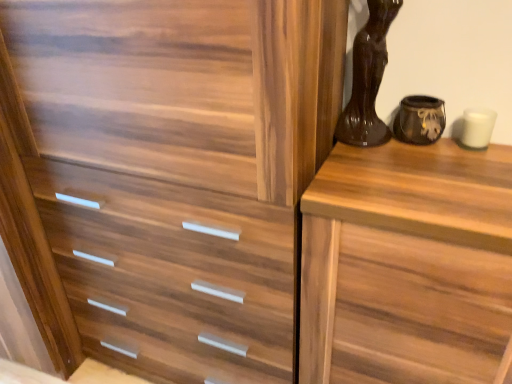
Question: Considering the relative positions of matte black vase at upper right, marked as the 1th vase in a right-to-left arrangement, and wooden chest of drawers at right in the image provided, is matte black vase at upper right, marked as the 1th vase in a right-to-left arrangement, to the left of wooden chest of drawers at right from the viewer's perspective?

Choices:
 (A) no
 (B) yes

Answer: (B)

Question: Is matte black vase at upper right, marked as the 1th vase in a right-to-left arrangement, directly adjacent to wooden chest of drawers at right?

Choices:
 (A) no
 (B) yes

Answer: (A)

Question: Is matte black vase at upper right, marked as the 1th vase in a right-to-left arrangement, not close to wooden chest of drawers at right?

Choices:
 (A) yes
 (B) no

Answer: (B)

Question: Considering the relative sizes of matte black vase at upper right, arranged as the 2th vase when viewed from the left, and wooden chest of drawers at right in the image provided, is matte black vase at upper right, arranged as the 2th vase when viewed from the left, taller than wooden chest of drawers at right?

Choices:
 (A) yes
 (B) no

Answer: (B)

Question: Does matte black vase at upper right, marked as the 1th vase in a right-to-left arrangement, have a lesser width compared to wooden chest of drawers at right?

Choices:
 (A) yes
 (B) no

Answer: (A)

Question: Does point (457, 177) appear closer or farther from the camera than point (437, 107)?

Choices:
 (A) farther
 (B) closer

Answer: (B)

Question: From the image's perspective, relative to matte black vase at upper right, arranged as the 2th vase when viewed from the left, is wooden chest of drawers at right above or below?

Choices:
 (A) above
 (B) below

Answer: (B)

Question: Looking at their shapes, would you say wooden chest of drawers at right is wider or thinner than matte black vase at upper right, marked as the 1th vase in a right-to-left arrangement?

Choices:
 (A) thin
 (B) wide

Answer: (B)

Question: Is wooden chest of drawers at right inside the boundaries of matte black vase at upper right, arranged as the 2th vase when viewed from the left, or outside?

Choices:
 (A) outside
 (B) inside

Answer: (A)

Question: Visually, is wooden chest of drawers at right positioned to the left or to the right of shiny brown vase at upper right, the first vase from the left?

Choices:
 (A) left
 (B) right

Answer: (B)

Question: In terms of width, does wooden chest of drawers at right look wider or thinner when compared to shiny brown vase at upper right, which is the 2th vase in right-to-left order?

Choices:
 (A) wide
 (B) thin

Answer: (A)

Question: Is point (401, 210) closer or farther from the camera than point (375, 54)?

Choices:
 (A) closer
 (B) farther

Answer: (A)

Question: In terms of height, does wooden chest of drawers at right look taller or shorter compared to shiny brown vase at upper right, the first vase from the left?

Choices:
 (A) short
 (B) tall

Answer: (B)

Question: In the image, is matte black vase at upper right, marked as the 1th vase in a right-to-left arrangement, on the left side or the right side of wooden chest of drawers at right?

Choices:
 (A) left
 (B) right

Answer: (A)

Question: Does point (430, 114) appear closer or farther from the camera than point (372, 201)?

Choices:
 (A) farther
 (B) closer

Answer: (A)